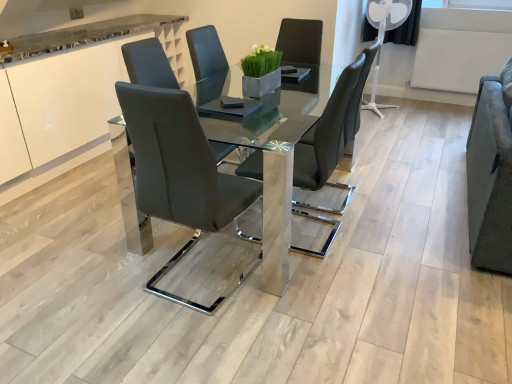
Locate an element on the screen. free space in front of matte black chair at center, placed as the 1th chair when sorted from right to left is located at coordinates (325, 285).